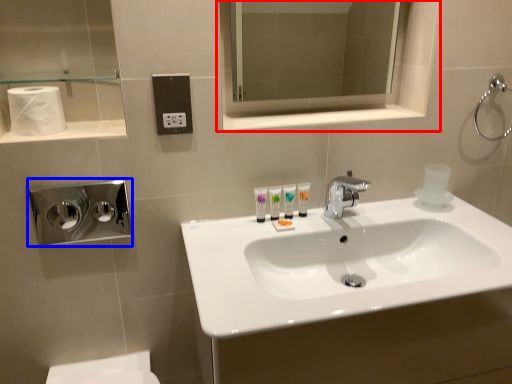
Question: Which of the following is the farthest to the observer, medicine cabinet (highlighted by a red box) or hand dryer (highlighted by a blue box)?

Choices:
 (A) medicine cabinet
 (B) hand dryer

Answer: (A)